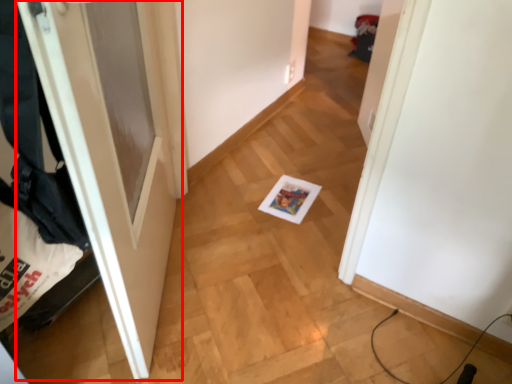
Question: Where is door (annotated by the red box) located in relation to laundry in the image?

Choices:
 (A) right
 (B) left

Answer: (A)